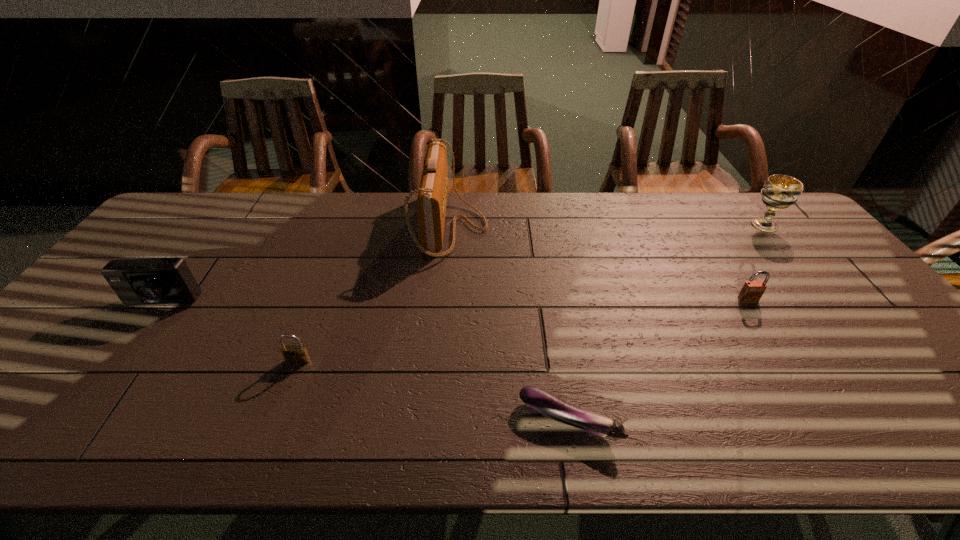
Locate an element on the screen. The height and width of the screenshot is (540, 960). handbag is located at coordinates (432, 198).

Where is `the tallest object`? Image resolution: width=960 pixels, height=540 pixels. the tallest object is located at coordinates (432, 198).

Identify the location of the rightmost object. (779, 192).

This screenshot has width=960, height=540. I want to click on chalice, so click(x=779, y=192).

Find the location of a particular element. camera is located at coordinates (152, 281).

Where is `the leftmost object`? This screenshot has height=540, width=960. the leftmost object is located at coordinates pos(152,281).

This screenshot has width=960, height=540. In order to click on the right padlock in this screenshot , I will do `click(752, 291)`.

Find the location of a particular element. the fifth object from left to right is located at coordinates click(752, 291).

Find the location of a particular element. The width and height of the screenshot is (960, 540). the second nearest object is located at coordinates (295, 354).

I want to click on the nearer padlock, so click(x=295, y=354).